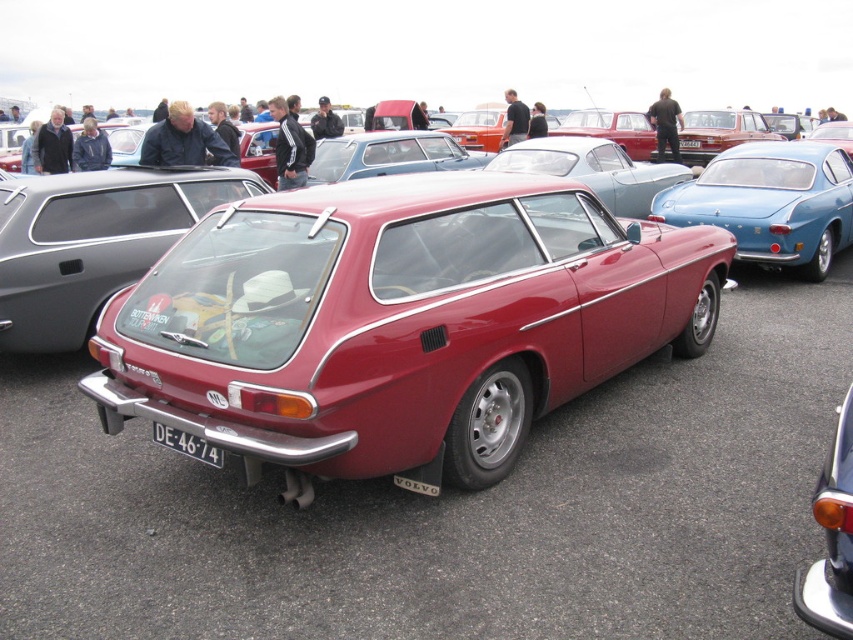
Based on the photo, is glossy metallic car at center smaller than glossy red station wagon at center?

Correct, glossy metallic car at center occupies less space than glossy red station wagon at center.

Is glossy metallic car at center positioned behind glossy red station wagon at center?

No, it is not.

Is point (834, 600) closer to viewer compared to point (578, 163)?

Yes, point (834, 600) is in front of point (578, 163).

The image size is (853, 640). I want to click on glossy metallic car at center, so click(x=831, y=538).

Is glossy red car at center below metallic silver sedan at center?

Indeed, glossy red car at center is positioned under metallic silver sedan at center.

Which is behind, point (189, 292) or point (136, 198)?

Positioned behind is point (136, 198).

Where is `glossy red car at center`? Image resolution: width=853 pixels, height=640 pixels. glossy red car at center is located at coordinates (398, 323).

Is glossy red car at center smaller than metallic blue car at center?

No.

Between glossy red car at center and metallic blue car at center, which one appears on the left side from the viewer's perspective?

Positioned to the left is glossy red car at center.

Between point (294, 323) and point (817, 230), which one is positioned behind?

The point (817, 230) is behind.

This screenshot has width=853, height=640. In order to click on glossy red car at center in this screenshot , I will do [x=398, y=323].